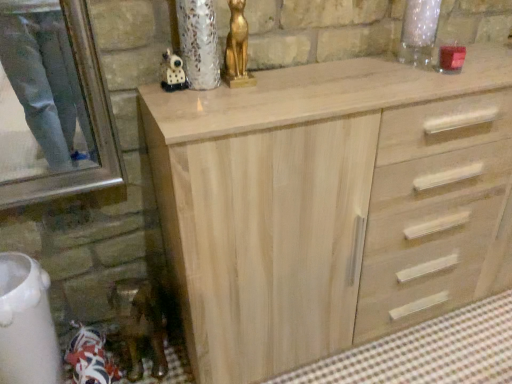
This screenshot has height=384, width=512. I want to click on space that is in front of matte black figurine at upper center, which ranks as the 2th miniature in left-to-right order, so click(x=196, y=109).